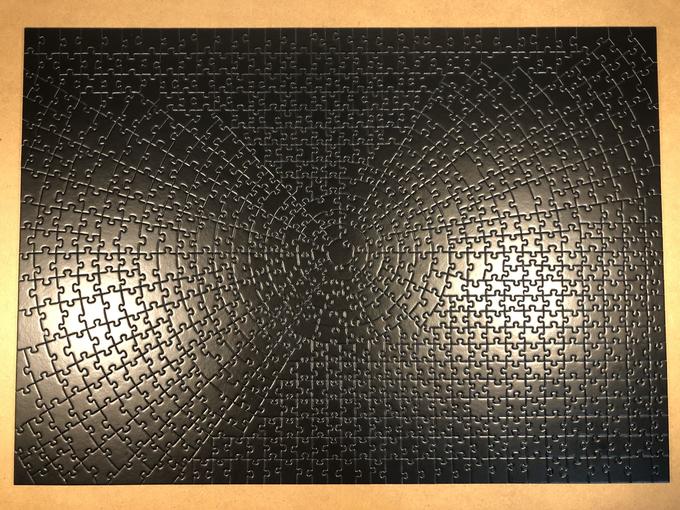
You are a GUI agent. You are given a task and a screenshot of the screen. Output one action in this format:
    pyautogui.click(x=<x>, y=<y>)
    Task: Click on the surface
    The image size is (680, 510).
    Given the screenshot: What is the action you would take?
    pyautogui.click(x=666, y=236)